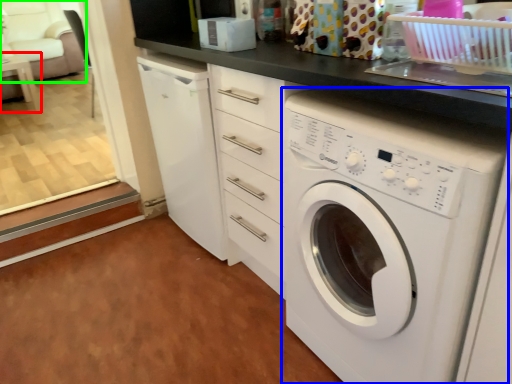
Question: Estimate the real-world distances between objects in this image. Which object is farther from table (highlighted by a red box), washing machine (highlighted by a blue box) or armchair (highlighted by a green box)?

Choices:
 (A) washing machine
 (B) armchair

Answer: (A)